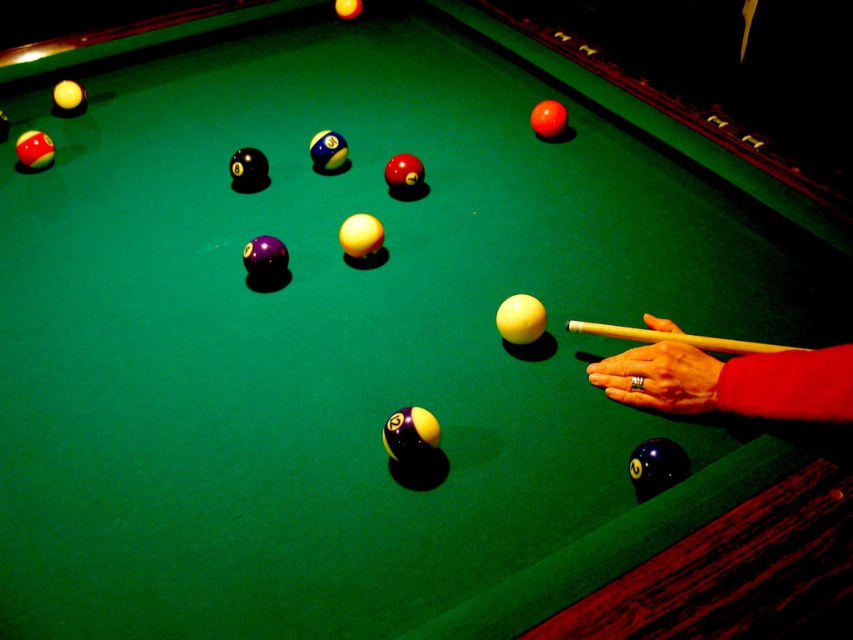
You are a pool player who wants to place a gold ring at lower right on top of the yellow wood cue at center. Is this possible given their sizes?

The gold ring at lower right has a greater height compared to yellow wood cue at center, so placing the gold ring at lower right on top of the yellow wood cue at center would not be possible due to the height difference.

You are a pool player trying to decide whether to use the smooth yellow cue stick at lower right to hit the gold ring at lower right. Considering their widths, which object is thinner?

The smooth yellow cue stick at lower right is thinner than the gold ring at lower right because the smooth yellow cue stick at lower right has a lesser width compared to the gold ring at lower right.